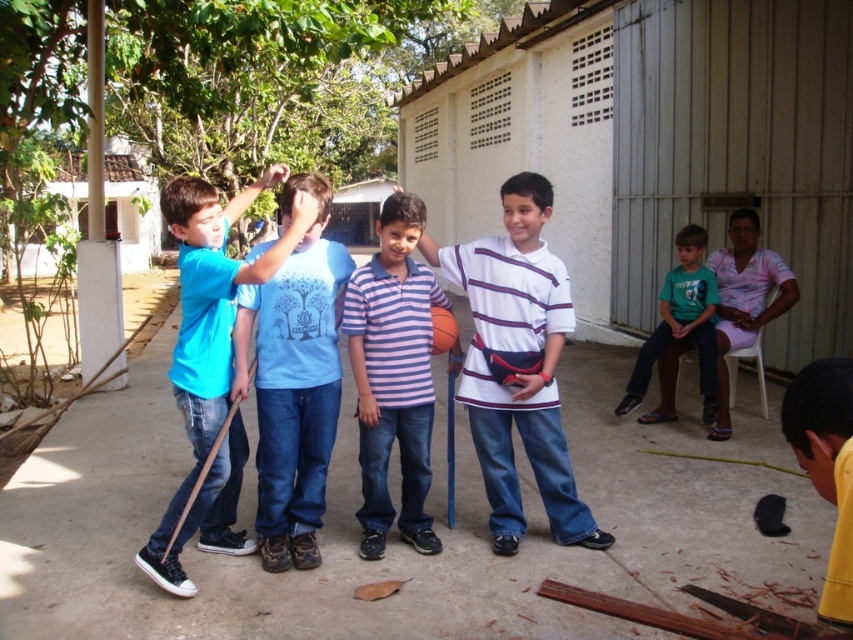
Question: Can you confirm if light blue cotton shirt at center is positioned above purple striped polo shirt at center?

Choices:
 (A) yes
 (B) no

Answer: (B)

Question: Is matte blue shirt at center positioned in front of green fabric shirt at right?

Choices:
 (A) no
 (B) yes

Answer: (B)

Question: Which is farther from the matte blue shirt at center?

Choices:
 (A) white striped shirt at center
 (B) green fabric shirt at right

Answer: (B)

Question: Does white striped shirt at center appear on the right side of light blue cotton shirt at center?

Choices:
 (A) no
 (B) yes

Answer: (B)

Question: Which point is farther to the camera?

Choices:
 (A) (143, 566)
 (B) (509, 392)
 (C) (712, 326)

Answer: (C)

Question: Among these objects, which one is farthest from the camera?

Choices:
 (A) purple striped polo shirt at center
 (B) matte blue shirt at center
 (C) white striped shirt at center
 (D) light blue cotton shirt at center

Answer: (C)